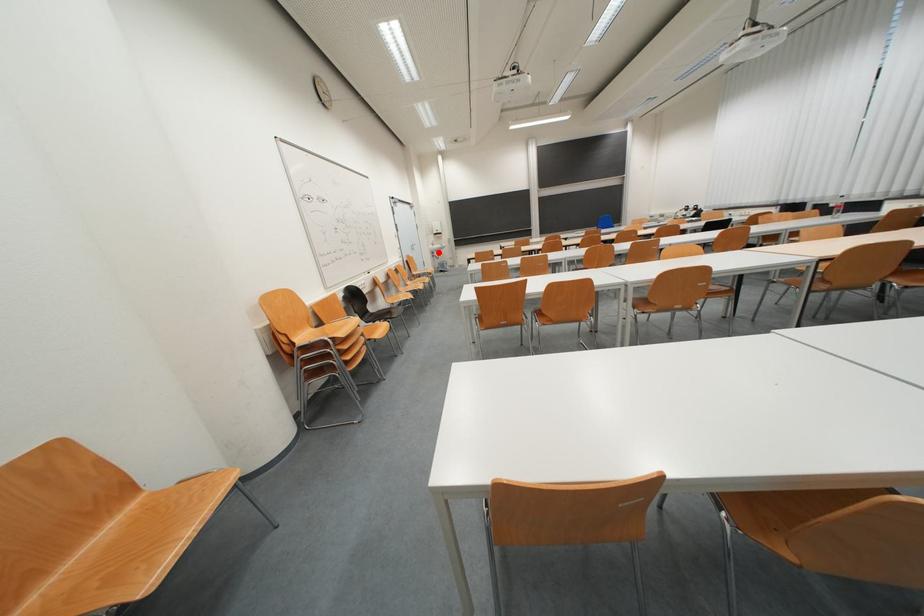
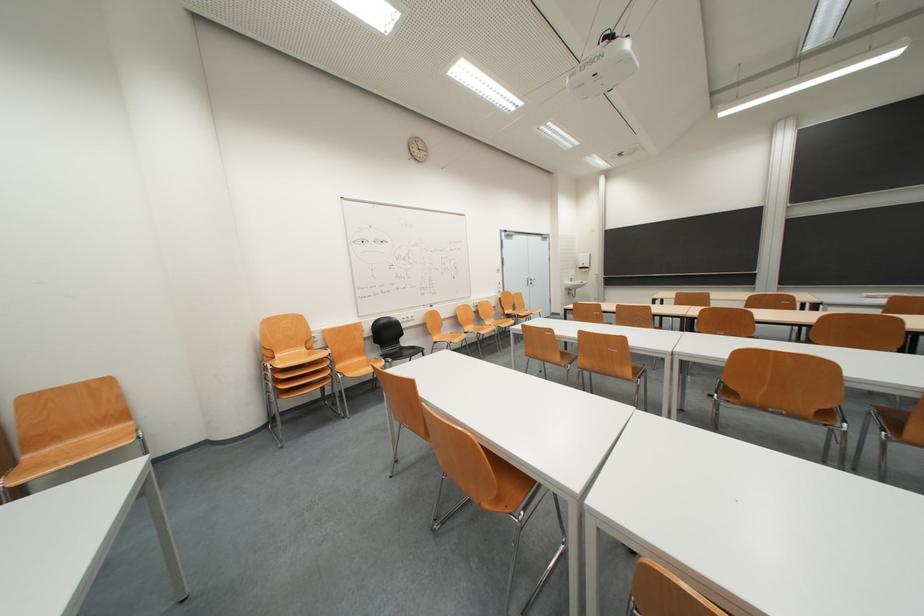
Find the pixel in the second image that matches the highlighted location in the first image.

(575, 288)